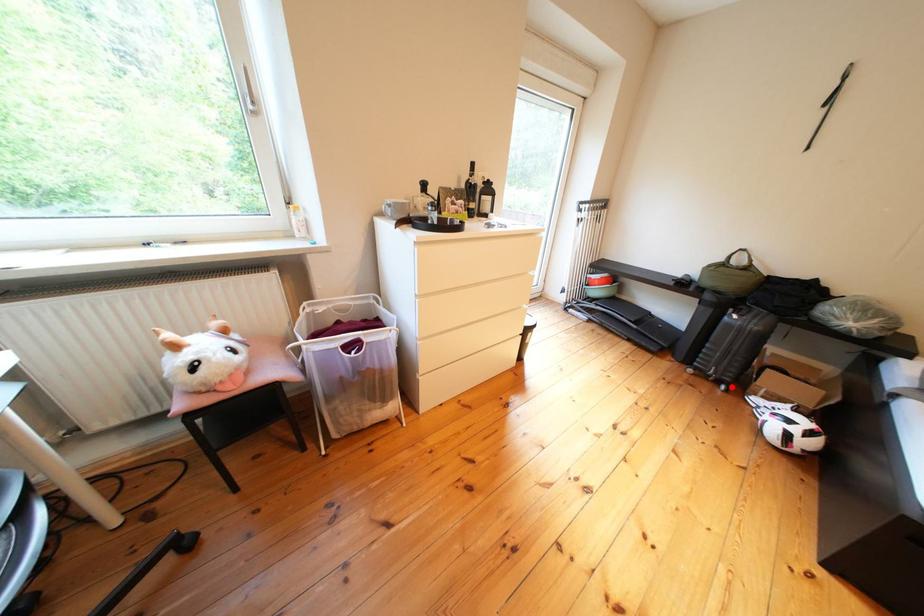
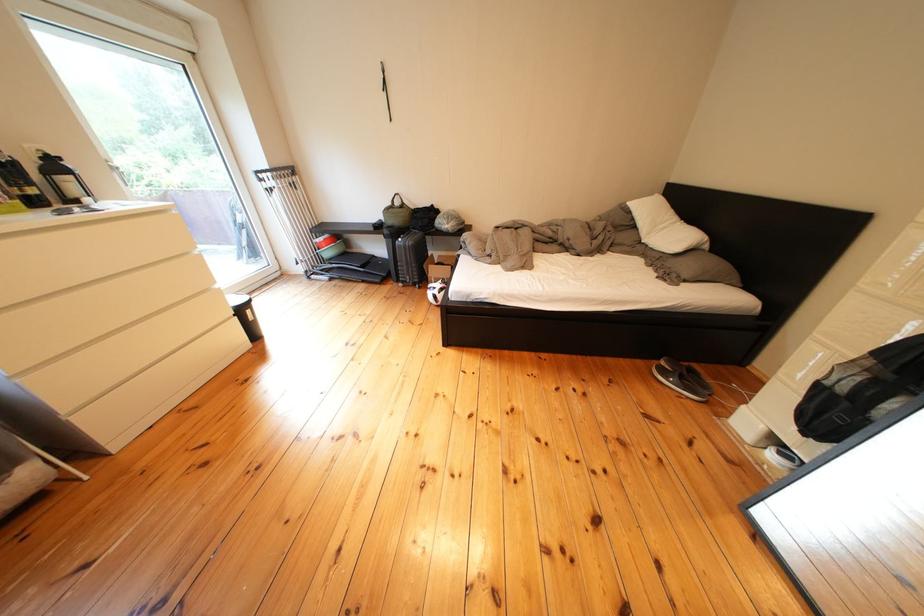
The point at the highlighted location is marked in the first image. Where is the corresponding point in the second image?

(429, 290)